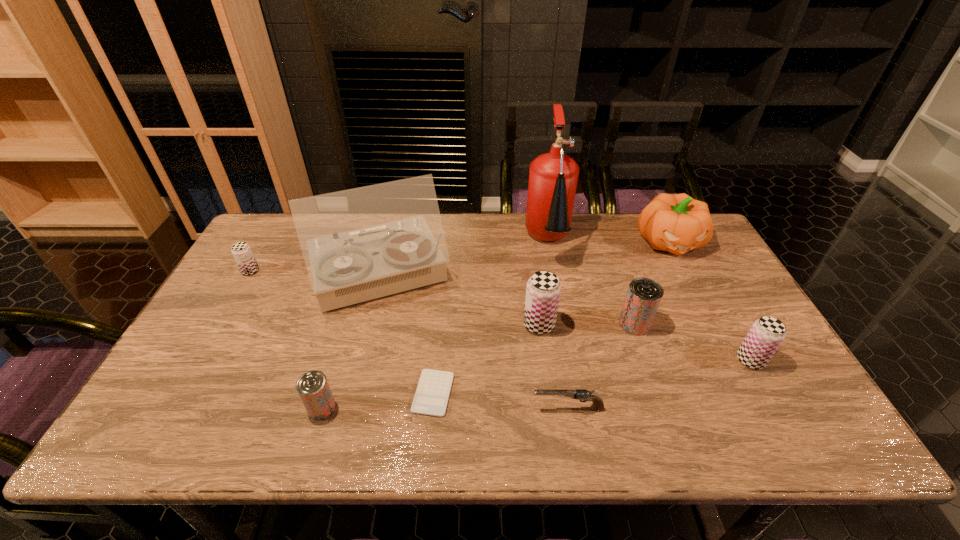
In order to click on vacant position in the image that satisfies the following two spatial constraints: 1. on the front side of the record player; 2. on the right side of the bigger red beer can in this screenshot , I will do `click(368, 324)`.

Where is `free space that satisfies the following two spatial constraints: 1. on the front side of the farther red beer can; 2. aiming along the barrel of the gun`? This screenshot has width=960, height=540. free space that satisfies the following two spatial constraints: 1. on the front side of the farther red beer can; 2. aiming along the barrel of the gun is located at coordinates (664, 408).